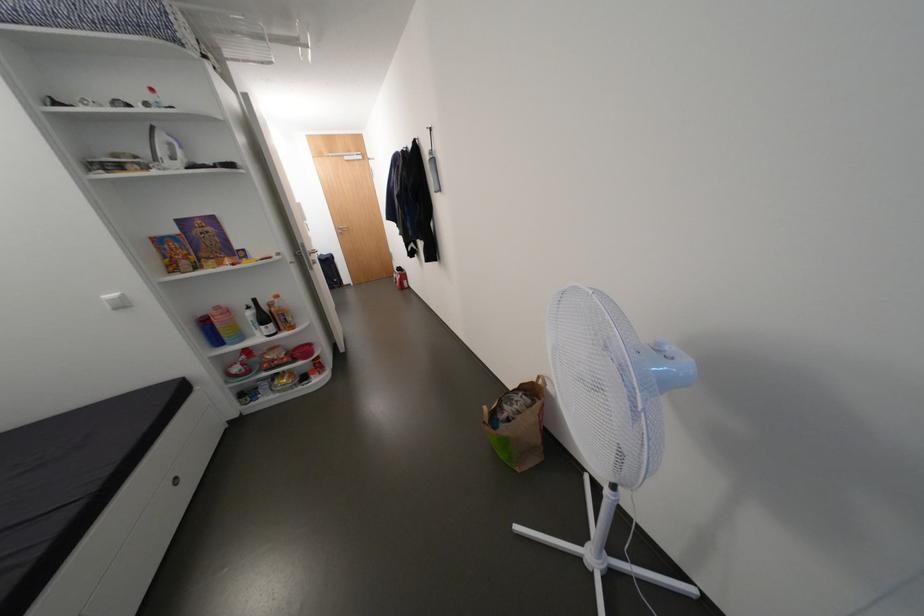
The image size is (924, 616). Describe the element at coordinates (175, 480) in the screenshot. I see `a white cabinet handle` at that location.